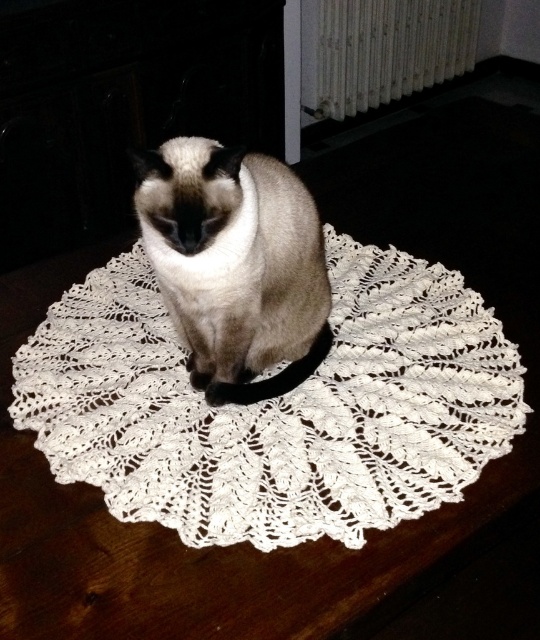
Between point (451, 401) and point (293, 346), which one is positioned behind?

Point (293, 346)

From the picture: Between white lace doily at center and silky fur cat at center, which one is positioned higher?

silky fur cat at center is above.

I want to click on white lace doily at center, so click(275, 406).

Find the location of a particular element. This screenshot has width=540, height=640. silky fur cat at center is located at coordinates (234, 264).

Is silky fur cat at center thinner than white textured radiator at upper center?

Yes, silky fur cat at center is thinner than white textured radiator at upper center.

Identify the location of silky fur cat at center. The image size is (540, 640). (234, 264).

Find the location of a particular element. silky fur cat at center is located at coordinates [x=234, y=264].

Does white lace doily at center have a lesser height compared to white textured radiator at upper center?

Yes, white lace doily at center is shorter than white textured radiator at upper center.

Who is shorter, white lace doily at center or white textured radiator at upper center?

With less height is white lace doily at center.

This screenshot has height=640, width=540. In order to click on white lace doily at center in this screenshot , I will do [275, 406].

Image resolution: width=540 pixels, height=640 pixels. What are the coordinates of `white lace doily at center` in the screenshot? It's located at (275, 406).